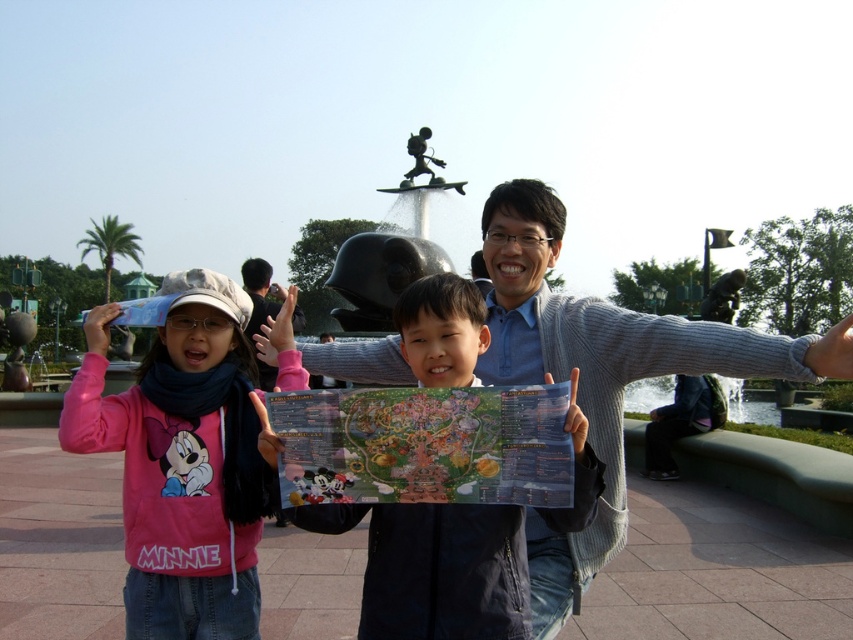
From the picture: Can you confirm if pink fleece sweatshirt at left is thinner than colorful glossy map at center?

Correct, pink fleece sweatshirt at left's width is less than colorful glossy map at center's.

Does pink fleece sweatshirt at left appear on the right side of colorful glossy map at center?

No, pink fleece sweatshirt at left is not to the right of colorful glossy map at center.

Identify the location of pink fleece sweatshirt at left. The image size is (853, 640). (183, 460).

Who is lower down, multicolored paper map at center or colorful glossy map at center?

multicolored paper map at center is below.

Who is more forward, [434,276] or [546,406]?

Point [546,406]

Locate an element on the screen. The image size is (853, 640). multicolored paper map at center is located at coordinates (445, 573).

Is colorful glossy map at center below black glossy water at center?

Yes.

I want to click on colorful glossy map at center, so click(424, 445).